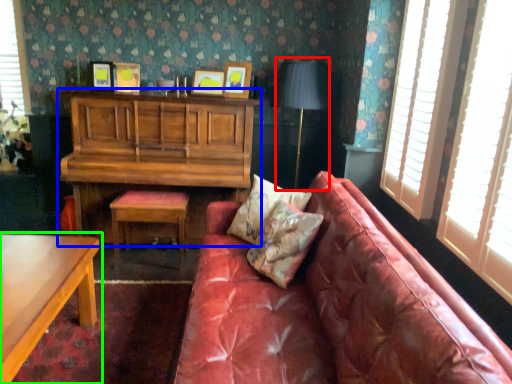
Question: Which object is the farthest from table lamp (highlighted by a red box)? Choose among these: cabinetry (highlighted by a blue box) or table (highlighted by a green box).

Choices:
 (A) cabinetry
 (B) table

Answer: (B)